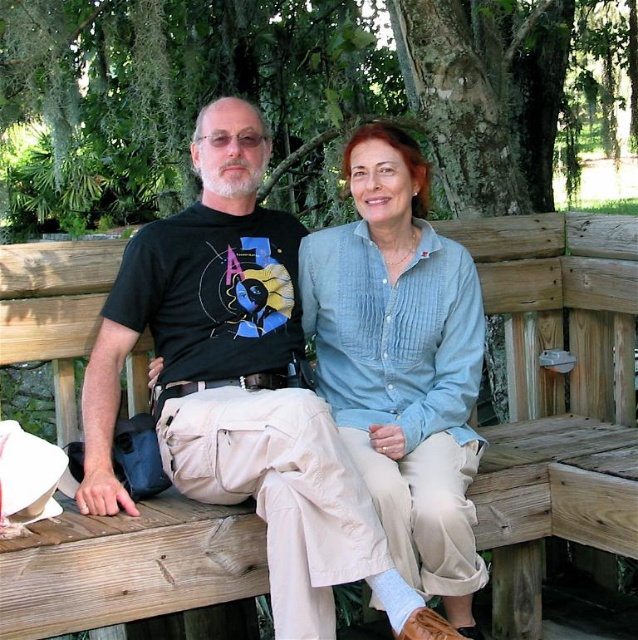
This screenshot has width=638, height=640. Describe the element at coordinates (560, 378) in the screenshot. I see `wooden bench at center` at that location.

Does wooden bench at center have a larger size compared to light blue cotton shirt at center?

Correct, wooden bench at center is larger in size than light blue cotton shirt at center.

Is point (4, 305) behind point (376, 145)?

No, (4, 305) is in front of (376, 145).

Identify the location of wooden bench at center. (560, 378).

Between green mossy tree at upper center and light blue cotton shirt at center, which one appears on the left side from the viewer's perspective?

green mossy tree at upper center is more to the left.

Who is positioned more to the right, green mossy tree at upper center or light blue cotton shirt at center?

Positioned to the right is light blue cotton shirt at center.

Measure the distance between point (463, 64) and camera.

The distance of point (463, 64) from camera is 3.70 meters.

What are the coordinates of `green mossy tree at upper center` in the screenshot? It's located at (300, 97).

Can you confirm if green mossy tree at upper center is wider than wooden bench at center?

Correct, the width of green mossy tree at upper center exceeds that of wooden bench at center.

Is green mossy tree at upper center positioned at the back of wooden bench at center?

Yes, it is.

Where is `green mossy tree at upper center`? green mossy tree at upper center is located at coordinates (300, 97).